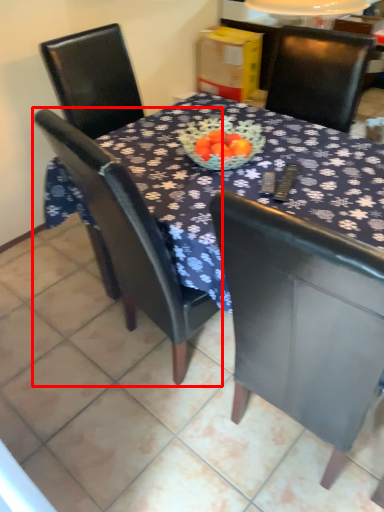
Question: From the image, what is the correct spatial relationship of chair (annotated by the red box) in relation to chair?

Choices:
 (A) left
 (B) right

Answer: (A)